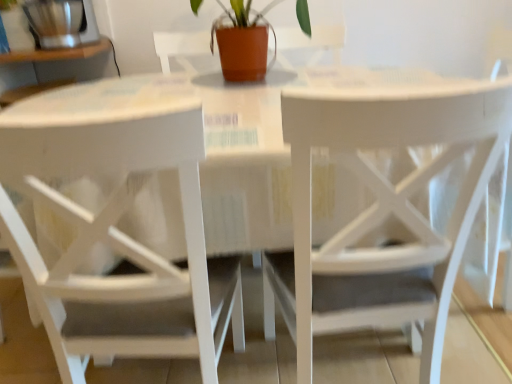
Question: Is point tap(272, 31) positioned closer to the camera than point tap(47, 1)?

Choices:
 (A) farther
 (B) closer

Answer: (A)

Question: From their relative heights in the image, would you say terracotta clay pot at center is taller or shorter than brushed metal coffee grinder at upper left?

Choices:
 (A) short
 (B) tall

Answer: (B)

Question: Based on their relative distances, which object is farther from the white wood chair at center, which appears as the second chair when viewed from the right?

Choices:
 (A) terracotta clay pot at center
 (B) white matte chair at center, the second chair positioned from the left
 (C) brushed metal coffee grinder at upper left

Answer: (C)

Question: Estimate the real-world distances between objects in this image. Which object is closer to the white wood chair at center, which appears as the second chair when viewed from the right?

Choices:
 (A) terracotta clay pot at center
 (B) brushed metal coffee grinder at upper left
 (C) white matte chair at center, arranged as the first chair when viewed from the right

Answer: (C)